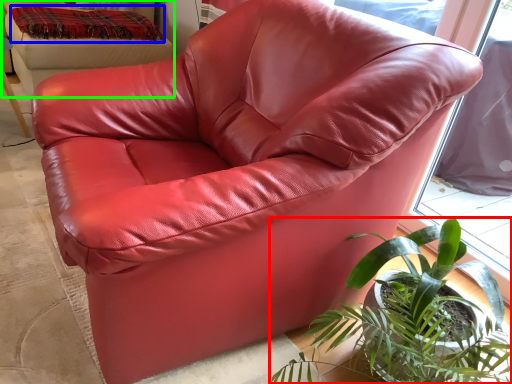
Question: Estimate the real-world distances between objects in this image. Which object is closer to houseplant (highlighted by a red box), blanket (highlighted by a blue box) or bean bag chair (highlighted by a green box)?

Choices:
 (A) blanket
 (B) bean bag chair

Answer: (B)